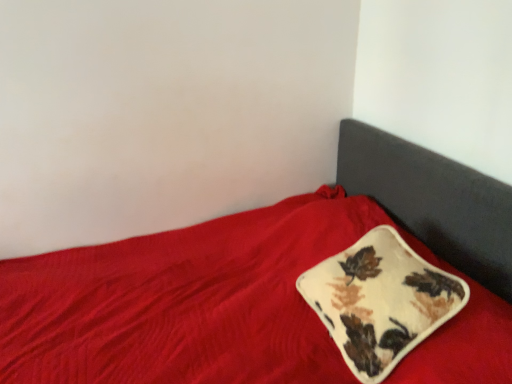
What is the approximate width of velvet red bed at center?

It is 5.09 feet.

Describe the element at coordinates (266, 284) in the screenshot. I see `velvet red bed at center` at that location.

This screenshot has width=512, height=384. I want to click on velvet red bed at center, so click(x=266, y=284).

The width and height of the screenshot is (512, 384). What do you see at coordinates (380, 301) in the screenshot?
I see `velvety cream pillow with autumn leaves at center` at bounding box center [380, 301].

The width and height of the screenshot is (512, 384). Identify the location of velvety cream pillow with autumn leaves at center. pyautogui.click(x=380, y=301).

Find the location of a particular element. The height and width of the screenshot is (384, 512). velvet red bed at center is located at coordinates (266, 284).

Consider the image. Between velvet red bed at center and velvety cream pillow with autumn leaves at center, which one appears on the left side from the viewer's perspective?

velvet red bed at center.

Considering their positions, is velvet red bed at center located in front of or behind velvety cream pillow with autumn leaves at center?

velvet red bed at center is positioned closer to the viewer than velvety cream pillow with autumn leaves at center.

Which is closer, (x=217, y=230) or (x=380, y=230)?

Point (x=217, y=230).

From the image's perspective, is velvet red bed at center located above or below velvety cream pillow with autumn leaves at center?

Clearly, from the image's perspective, velvet red bed at center is below velvety cream pillow with autumn leaves at center.

From a real-world perspective, is velvet red bed at center physically located above or below velvety cream pillow with autumn leaves at center?

velvet red bed at center is below velvety cream pillow with autumn leaves at center.

Considering the relative sizes of velvet red bed at center and velvety cream pillow with autumn leaves at center in the image provided, is velvet red bed at center thinner than velvety cream pillow with autumn leaves at center?

Incorrect, the width of velvet red bed at center is not less than that of velvety cream pillow with autumn leaves at center.

Does velvet red bed at center have a lesser height compared to velvety cream pillow with autumn leaves at center?

In fact, velvet red bed at center may be taller than velvety cream pillow with autumn leaves at center.

From the picture: Between velvet red bed at center and velvety cream pillow with autumn leaves at center, which one has smaller size?

velvety cream pillow with autumn leaves at center.

Does velvet red bed at center contain velvety cream pillow with autumn leaves at center?

Yes, velvety cream pillow with autumn leaves at center is a part of velvet red bed at center.

Is velvet red bed at center positioned far away from velvety cream pillow with autumn leaves at center?

velvet red bed at center is actually quite close to velvety cream pillow with autumn leaves at center.

Is velvet red bed at center looking in the opposite direction of velvety cream pillow with autumn leaves at center?

Yes, velvet red bed at center's orientation is away from velvety cream pillow with autumn leaves at center.

Measure the distance from velvet red bed at center to velvety cream pillow with autumn leaves at center.

velvet red bed at center is 8.65 inches away from velvety cream pillow with autumn leaves at center.

In order to click on pillow lying on the right of velvet red bed at center in this screenshot , I will do `click(380, 301)`.

Does velvety cream pillow with autumn leaves at center appear on the right side of velvet red bed at center?

Yes, velvety cream pillow with autumn leaves at center is to the right of velvet red bed at center.

Which object is further away from the camera taking this photo, velvety cream pillow with autumn leaves at center or velvet red bed at center?

velvety cream pillow with autumn leaves at center is further away from the camera.

Considering the positions of point (432, 307) and point (361, 185), is point (432, 307) closer or farther from the camera than point (361, 185)?

Clearly, point (432, 307) is closer to the camera than point (361, 185).

From the image's perspective, is velvety cream pillow with autumn leaves at center located above or below velvet red bed at center?

velvety cream pillow with autumn leaves at center is situated higher than velvet red bed at center in the image.

From a real-world perspective, is velvety cream pillow with autumn leaves at center positioned above or below velvet red bed at center?

From a real-world perspective, velvety cream pillow with autumn leaves at center is physically above velvet red bed at center.

Considering the relative sizes of velvety cream pillow with autumn leaves at center and velvet red bed at center in the image provided, is velvety cream pillow with autumn leaves at center wider than velvet red bed at center?

In fact, velvety cream pillow with autumn leaves at center might be narrower than velvet red bed at center.

Which of these two, velvety cream pillow with autumn leaves at center or velvet red bed at center, stands taller?

Standing taller between the two is velvet red bed at center.

Considering the sizes of objects velvety cream pillow with autumn leaves at center and velvet red bed at center in the image provided, who is smaller, velvety cream pillow with autumn leaves at center or velvet red bed at center?

With smaller size is velvety cream pillow with autumn leaves at center.

Can velvet red bed at center be found inside velvety cream pillow with autumn leaves at center?

No, velvety cream pillow with autumn leaves at center does not contain velvet red bed at center.

Is velvety cream pillow with autumn leaves at center with velvet red bed at center?

No, velvety cream pillow with autumn leaves at center is not making contact with velvet red bed at center.

Is velvety cream pillow with autumn leaves at center facing towards velvet red bed at center?

Yes, velvety cream pillow with autumn leaves at center is oriented towards velvet red bed at center.

This screenshot has height=384, width=512. I want to click on bed below the velvety cream pillow with autumn leaves at center (from the image's perspective), so click(266, 284).

Locate an element on the screen. bed located on the left of velvety cream pillow with autumn leaves at center is located at coordinates (266, 284).

I want to click on bed beneath the velvety cream pillow with autumn leaves at center (from a real-world perspective), so click(x=266, y=284).